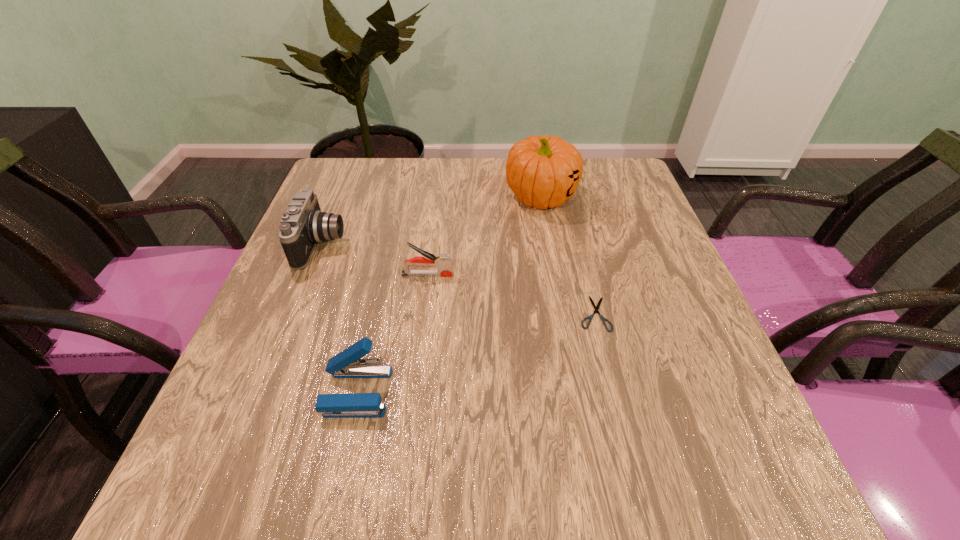
Find the location of a particular element. Image resolution: width=960 pixels, height=540 pixels. free space between the camera and the farthest object is located at coordinates (432, 221).

Where is `free space between the farther stapler and the tallest object`? free space between the farther stapler and the tallest object is located at coordinates (484, 235).

The height and width of the screenshot is (540, 960). What are the coordinates of `vacant area that lies between the camera and the farther stapler` in the screenshot? It's located at (374, 260).

I want to click on free point between the farthest object and the nearer stapler, so click(x=449, y=294).

Identify the location of vacant point located between the farthest object and the nearest object. (449, 294).

Locate an element on the screen. free space that is in between the second nearest object and the camera is located at coordinates (458, 279).

At what (x,y) coordinates should I click in order to perform the action: click on vacant area that lies between the pumpkin and the shortest object. Please return your answer as a coordinate pair (x, y). Looking at the image, I should click on (567, 255).

Locate an element on the screen. free space that is in between the nearer stapler and the shears is located at coordinates (475, 353).

You are a GUI agent. You are given a task and a screenshot of the screen. Output one action in this format:
    pyautogui.click(x=<x>, y=<y>)
    Task: Click on the vacant space that is in between the shortest object and the farthest object
    
    Given the screenshot: What is the action you would take?
    pyautogui.click(x=567, y=255)

Where is `blank region between the second tallest object and the farther stapler`? The width and height of the screenshot is (960, 540). blank region between the second tallest object and the farther stapler is located at coordinates (374, 260).